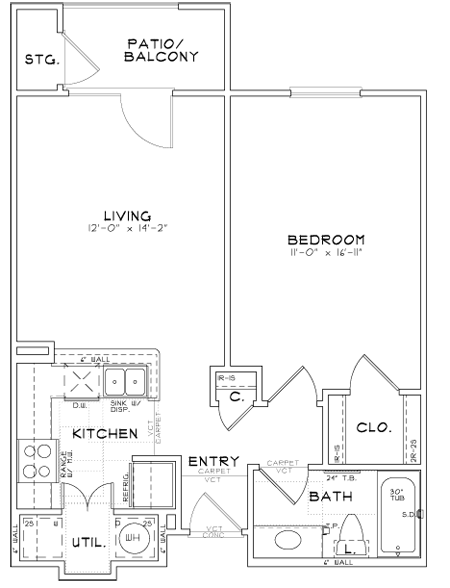
Where is `room you cook in`? room you cook in is located at coordinates click(x=92, y=441).